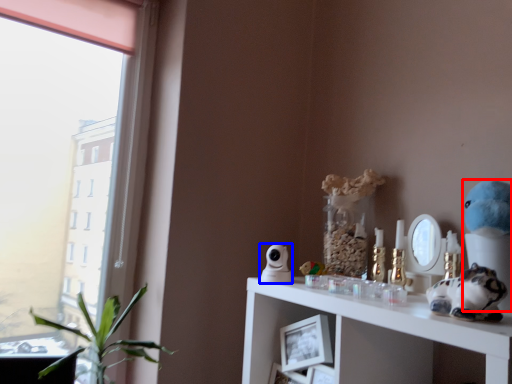
Question: Which of the following is the farthest to the observer, figurine (highlighted by a red box) or figurine (highlighted by a blue box)?

Choices:
 (A) figurine
 (B) figurine

Answer: (B)